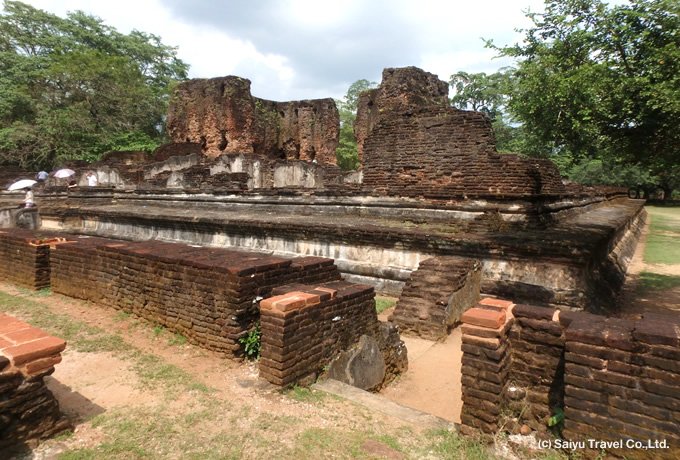
At what (x,y) coordinates should I click in order to perform the action: click on terracotta brick. Please return your answer as a coordinate pair (x, y). This screenshot has height=460, width=680. Looking at the image, I should click on (279, 304).